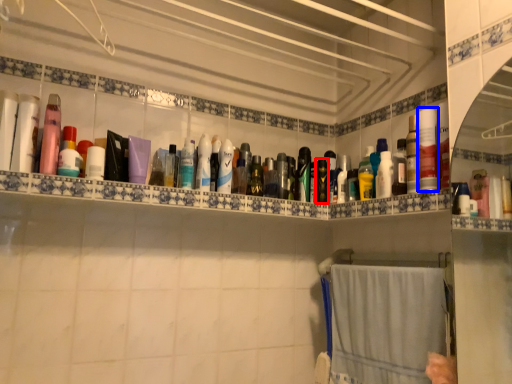
Question: Which point is closer to the camera, toiletry (highlighted by a red box) or toiletry (highlighted by a blue box)?

Choices:
 (A) toiletry
 (B) toiletry

Answer: (B)